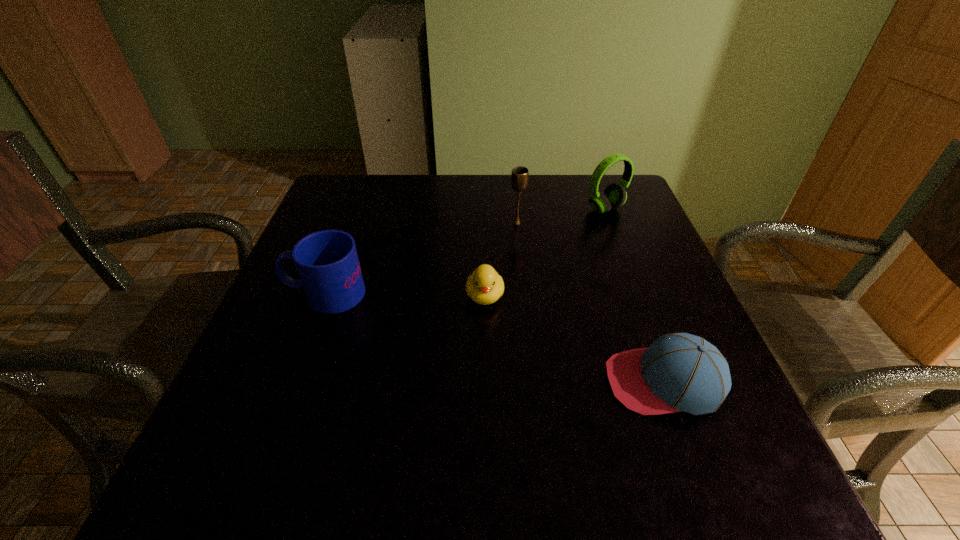
The height and width of the screenshot is (540, 960). I want to click on free space located on the front-facing side of the baseball cap, so click(559, 382).

You are a GUI agent. You are given a task and a screenshot of the screen. Output one action in this format:
    pyautogui.click(x=<x>, y=<y>)
    Task: Click on the vacant area situated on the front-facing side of the baseball cap
    The image size is (960, 540).
    Given the screenshot: What is the action you would take?
    pyautogui.click(x=498, y=382)

Locate an element on the screen. The height and width of the screenshot is (540, 960). free space located 0.210m on the beak of the duckling is located at coordinates (486, 410).

At what (x,y) coordinates should I click in order to perform the action: click on headset present at the far edge. Please return your answer as a coordinate pair (x, y). Looking at the image, I should click on (614, 196).

Where is `chalice that is at the far edge`? chalice that is at the far edge is located at coordinates (519, 176).

You are a GUI agent. You are given a task and a screenshot of the screen. Output one action in this format:
    pyautogui.click(x=<x>, y=<y>)
    Task: Click on the object present at the left edge
    
    Given the screenshot: What is the action you would take?
    pyautogui.click(x=327, y=262)

Locate an element on the screen. The width and height of the screenshot is (960, 540). headset present at the right edge is located at coordinates (614, 196).

Locate an element on the screen. baseball cap present at the right edge is located at coordinates (678, 372).

Locate an element on the screen. object located at the far right corner is located at coordinates (614, 196).

This screenshot has width=960, height=540. Find the location of `vacant space at the far edge of the desktop`. vacant space at the far edge of the desktop is located at coordinates (421, 184).